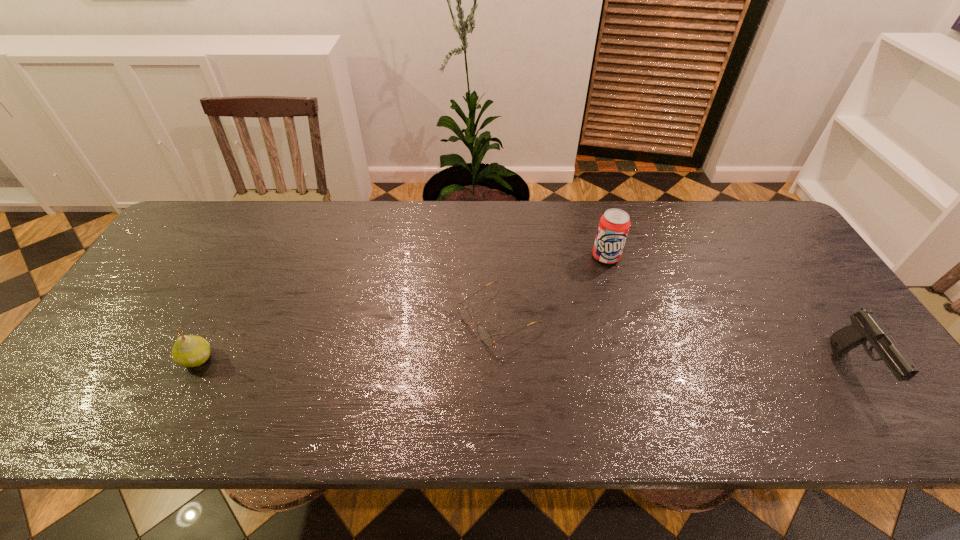
Identify the location of pear. This screenshot has height=540, width=960. (188, 351).

The height and width of the screenshot is (540, 960). I want to click on pistol, so click(865, 326).

Locate an element on the screen. The height and width of the screenshot is (540, 960). the shortest object is located at coordinates (463, 312).

Locate an element on the screen. The height and width of the screenshot is (540, 960). the third object from right to left is located at coordinates (463, 312).

Identify the location of the tallest object. (614, 224).

The height and width of the screenshot is (540, 960). I want to click on the farthest object, so point(614,224).

At what (x,y) coordinates should I click in order to perform the action: click on vacant space situated 0.350m on the right of the pear. Please return your answer as a coordinate pair (x, y). The height and width of the screenshot is (540, 960). Looking at the image, I should click on (359, 359).

Identify the location of vacant region located 0.200m on the temples of the shortest object. Image resolution: width=960 pixels, height=540 pixels. (395, 381).

In order to click on blank space located on the temples of the shortest object in this screenshot , I will do `click(435, 356)`.

In order to click on free space located on the temples of the shortest object in this screenshot , I will do `click(398, 379)`.